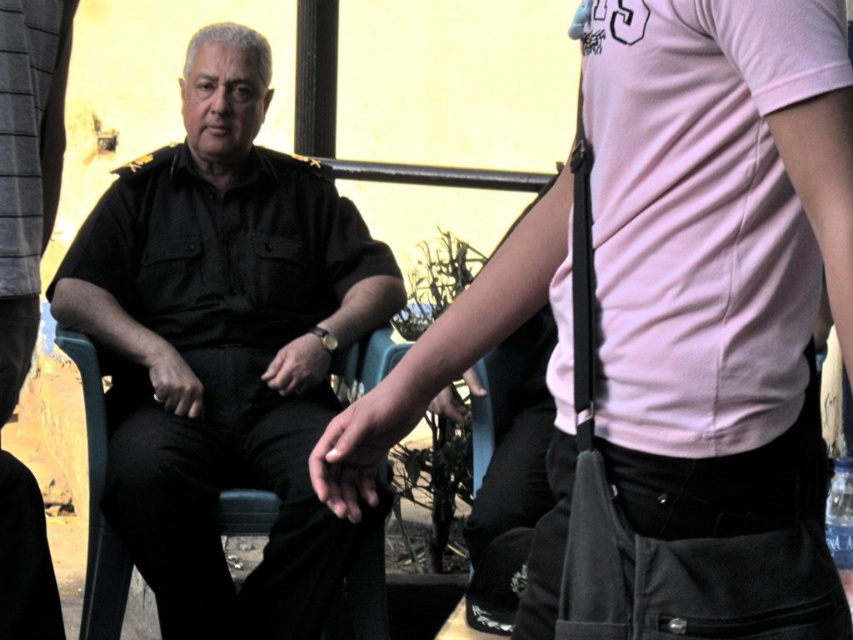
Question: Among these points, which one is nearest to the camera?

Choices:
 (A) (779, 56)
 (B) (241, 250)

Answer: (A)

Question: Is pink matte shirt at center closer to camera compared to black uniform at center?

Choices:
 (A) yes
 (B) no

Answer: (A)

Question: Can you confirm if pink matte shirt at center is positioned above black uniform at center?

Choices:
 (A) no
 (B) yes

Answer: (A)

Question: Which of the following is the closest to the observer?

Choices:
 (A) pink matte shirt at center
 (B) black uniform at center

Answer: (A)

Question: Can you confirm if pink matte shirt at center is smaller than black uniform at center?

Choices:
 (A) no
 (B) yes

Answer: (B)